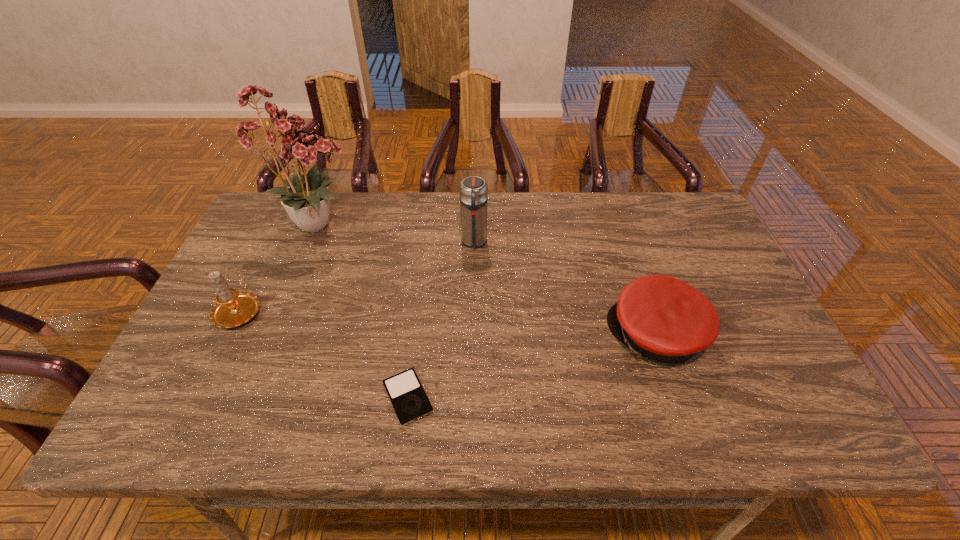
The height and width of the screenshot is (540, 960). Identify the location of free space between the third tallest object and the iPod. (324, 354).

At what (x,y) coordinates should I click in order to perform the action: click on empty space that is in between the tallest object and the third object from right to left. Please return your answer as a coordinate pair (x, y). The image size is (960, 540). Looking at the image, I should click on (364, 310).

The image size is (960, 540). I want to click on free space between the flower arrangement and the fourth object from left to right, so click(396, 233).

Find the location of a particular element. The height and width of the screenshot is (540, 960). empty space that is in between the fourth tallest object and the thermos bottle is located at coordinates (565, 289).

This screenshot has height=540, width=960. What are the coordinates of `free area in between the cap and the candle` in the screenshot? It's located at (448, 323).

Locate which object is the second closest to the fourth object from left to right. Please provide its 2D coordinates. Your answer should be formatted as a tuple, i.e. [(x, y)], where the tuple contains the x and y coordinates of a point satisfying the conditions above.

[(660, 318)]

Point out which object is positioned as the nearest to the second tallest object. Please provide its 2D coordinates. Your answer should be formatted as a tuple, i.e. [(x, y)], where the tuple contains the x and y coordinates of a point satisfying the conditions above.

[(307, 199)]

The image size is (960, 540). I want to click on free spot that satisfies the following two spatial constraints: 1. on the front-facing side of the flower arrangement; 2. on the front side of the candle, so click(285, 310).

Where is `vacant space that satisfies the following two spatial constraints: 1. on the back side of the shortest object; 2. on the front-facing side of the tallest object`? vacant space that satisfies the following two spatial constraints: 1. on the back side of the shortest object; 2. on the front-facing side of the tallest object is located at coordinates (429, 224).